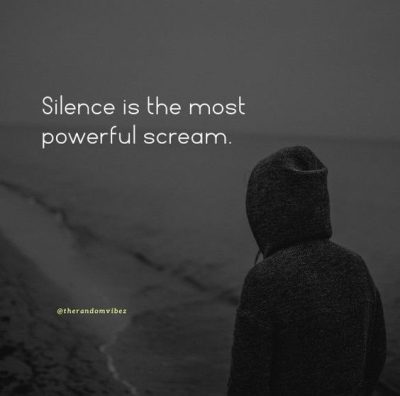
Identify the location of hood. (298, 199).